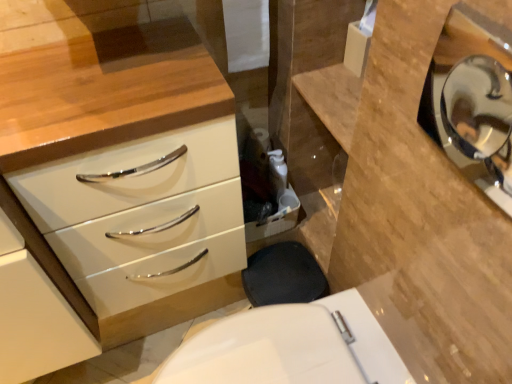
Question: Does white glossy chest of drawers at left appear on the left side of polished silver mirror at upper right?

Choices:
 (A) no
 (B) yes

Answer: (B)

Question: Can you confirm if white glossy chest of drawers at left is smaller than polished silver mirror at upper right?

Choices:
 (A) no
 (B) yes

Answer: (A)

Question: From the image's perspective, is white glossy chest of drawers at left under polished silver mirror at upper right?

Choices:
 (A) no
 (B) yes

Answer: (B)

Question: Is white glossy chest of drawers at left taller than polished silver mirror at upper right?

Choices:
 (A) yes
 (B) no

Answer: (A)

Question: Is white glossy chest of drawers at left to the right of polished silver mirror at upper right from the viewer's perspective?

Choices:
 (A) no
 (B) yes

Answer: (A)

Question: Is white glossy chest of drawers at left in front of polished silver mirror at upper right?

Choices:
 (A) yes
 (B) no

Answer: (B)

Question: From the image's perspective, is white glossy toilet at lower center on top of polished silver mirror at upper right?

Choices:
 (A) yes
 (B) no

Answer: (B)

Question: Is white glossy toilet at lower center in contact with polished silver mirror at upper right?

Choices:
 (A) no
 (B) yes

Answer: (A)

Question: Could you tell me if white glossy toilet at lower center is turned towards polished silver mirror at upper right?

Choices:
 (A) yes
 (B) no

Answer: (B)

Question: From a real-world perspective, is white glossy toilet at lower center physically above polished silver mirror at upper right?

Choices:
 (A) yes
 (B) no

Answer: (B)

Question: Is white glossy toilet at lower center surrounding polished silver mirror at upper right?

Choices:
 (A) no
 (B) yes

Answer: (A)

Question: Is polished silver mirror at upper right at the back of white glossy toilet at lower center?

Choices:
 (A) no
 (B) yes

Answer: (A)

Question: Is polished silver mirror at upper right closer to the viewer compared to white glossy chest of drawers at left?

Choices:
 (A) yes
 (B) no

Answer: (A)